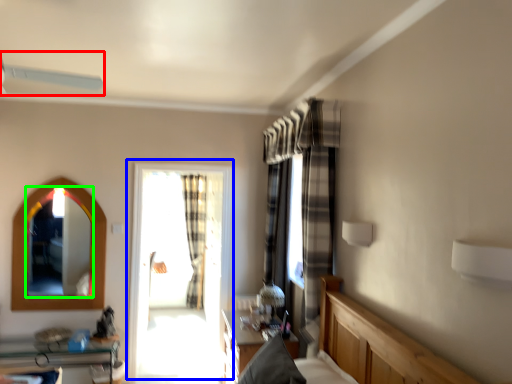
Question: Which object is positioned closest to fan (highlighted by a red box)? Select from window (highlighted by a blue box) and mirror (highlighted by a green box).

Choices:
 (A) window
 (B) mirror

Answer: (B)